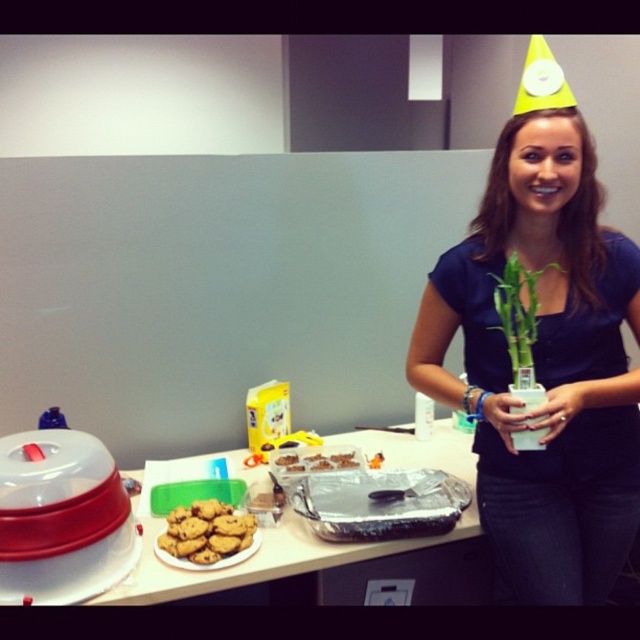
Question: Among these points, which one is farthest from the camera?

Choices:
 (A) pos(524,324)
 (B) pos(342,452)
 (C) pos(580,337)

Answer: (B)

Question: Is green bamboo at center above chocolate chip cookie dough at center?

Choices:
 (A) no
 (B) yes

Answer: (B)

Question: Does matte blue shirt at center come behind green bamboo at center?

Choices:
 (A) yes
 (B) no

Answer: (B)

Question: Does matte blue shirt at center appear under chocolate chip cookie dough at center?

Choices:
 (A) yes
 (B) no

Answer: (B)

Question: Considering the real-world distances, which object is farthest from the matte blue shirt at center?

Choices:
 (A) chocolate chip cookie dough at center
 (B) green bamboo at center
 (C) white plastic table at center

Answer: (A)

Question: Which of the following is the farthest from the observer?

Choices:
 (A) white plastic table at center
 (B) chocolate chip cookies at center
 (C) chocolate chip cookie dough at center
 (D) green bamboo at center

Answer: (C)